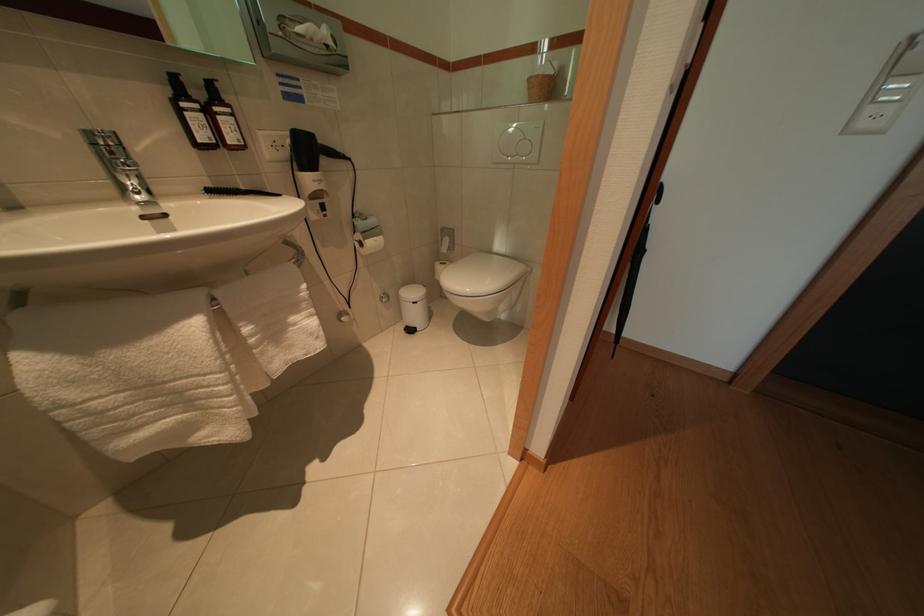
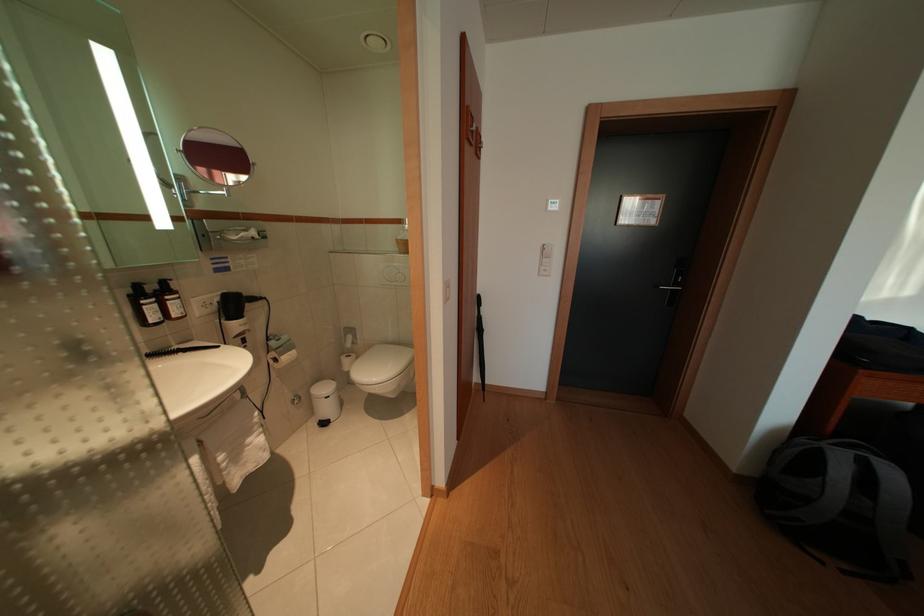
In the second image, find the point that corresponds to the point at 205,127 in the first image.

(159, 315)